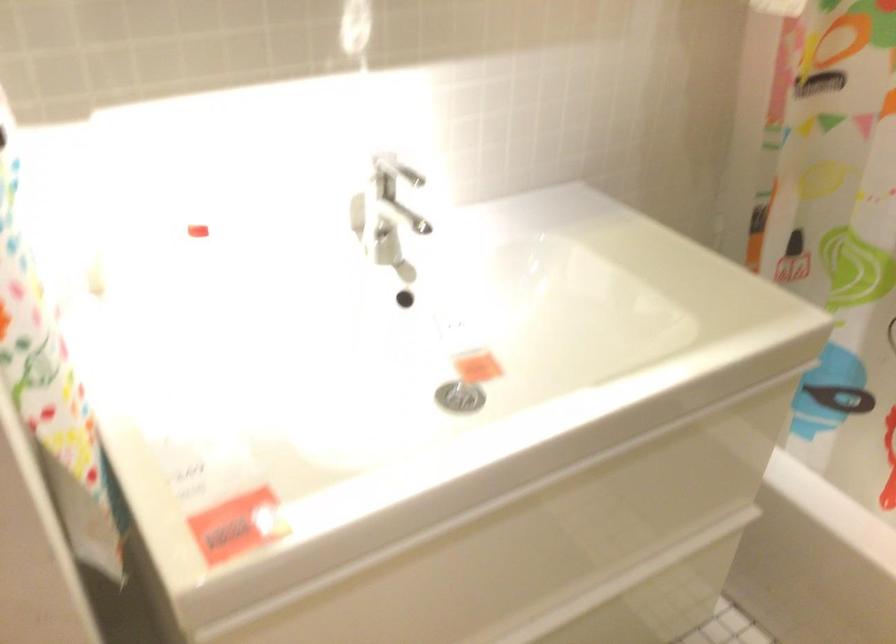
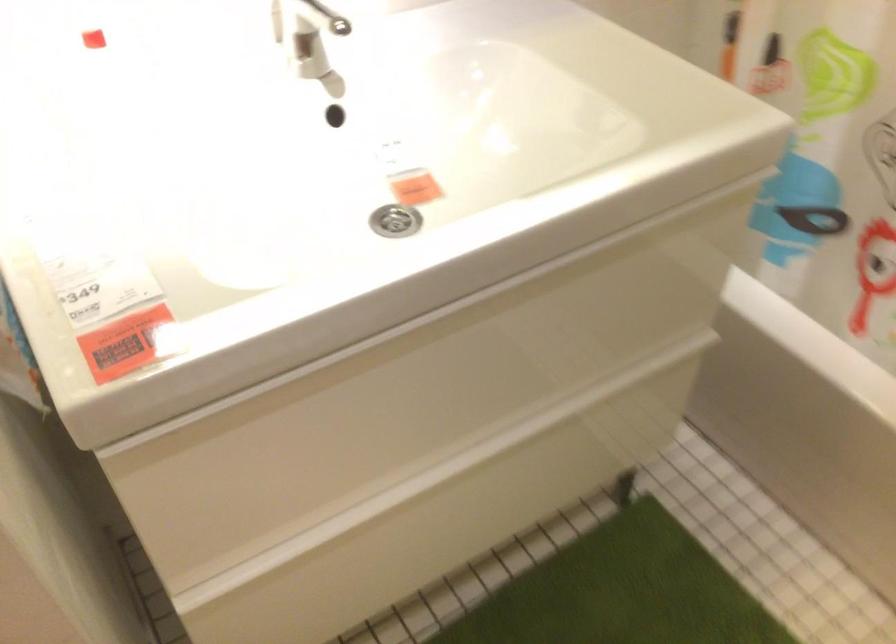
Find the pixel in the second image that matches point 457,398 in the first image.

(394, 221)